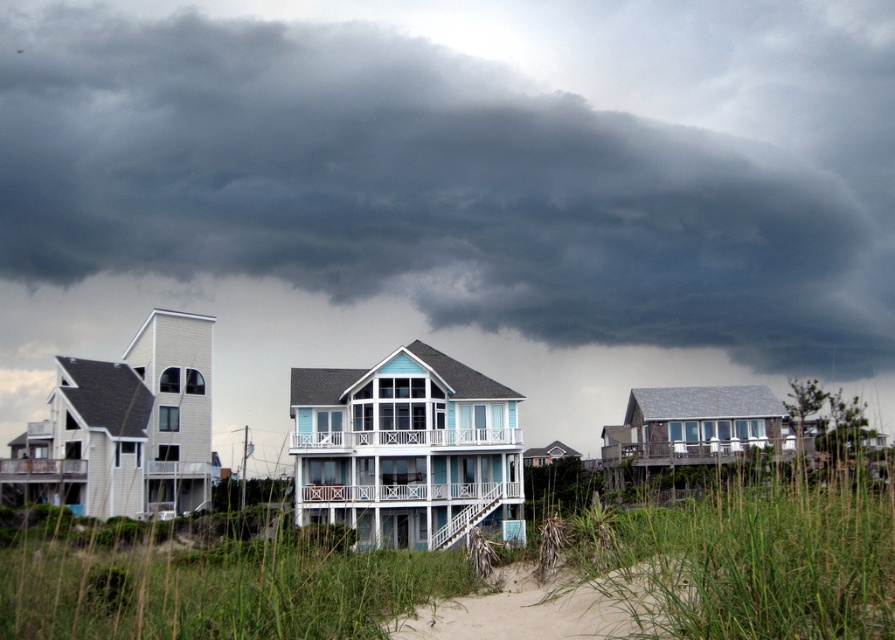
You are planning to take a walk on the sandy beach at lower center but notice the dark gray cloud at upper center in the sky. Based on the scene description, what might happen if you proceed with your walk?

The dark gray cloud at upper center is positioned over the sandy beach at lower center, which suggests that rain or a storm might reach the beach area, so proceeding with the walk could result in getting caught in the rain or storm.

You are a photographer planning to capture the beach houses and the dramatic sky. Given the dark gray cloud at upper center and the sandy beach at lower center, which one would you focus on if you want to emphasize something large in the scene?

The dark gray cloud at upper center is larger in size than the sandy beach at lower center, so focusing on the dark gray cloud at upper center would emphasize the large element in the scene.

From the picture: You are a photographer planning to take a picture of the coastal scene. You want to ensure both the dark gray cloud at upper center and the sandy beach at lower center are visible in the frame. Based on their positions, which object should you position closer to the left side of your camera viewfinder?

The dark gray cloud at upper center should be positioned closer to the left side of the camera viewfinder since it is already located to the left of the sandy beach at lower center.